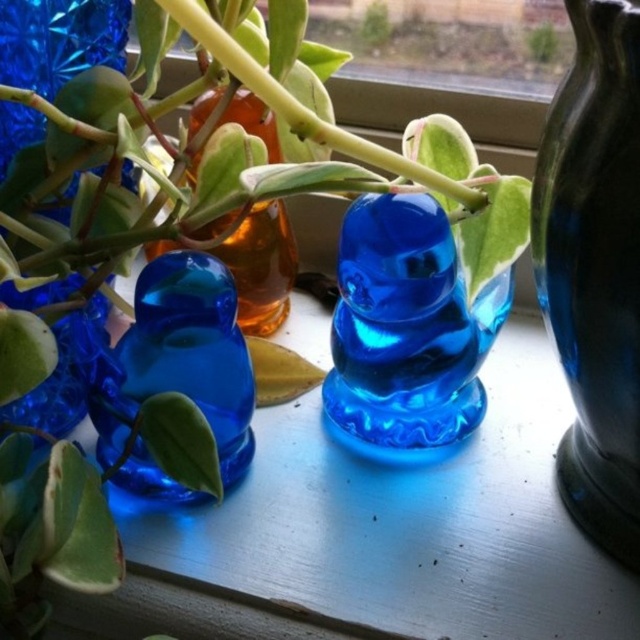
You are an interior designer arranging glass objects on a windowsill. You have a transparent blue glass duck at center and a transparent blue glass at left. Which object is positioned lower on the windowsill?

The transparent blue glass duck at center is located below the transparent blue glass at left, so it is positioned lower on the windowsill.

You are arranging flowers in the image and need to place a bouquet between the transparent blue glass duck at center and the transparent glass duck at left. Can you fit the bouquet between them?

The transparent blue glass duck at center is positioned over the transparent glass duck at left, meaning they are stacked vertically rather than side by side. Therefore, there is no horizontal space between them to place a bouquet.